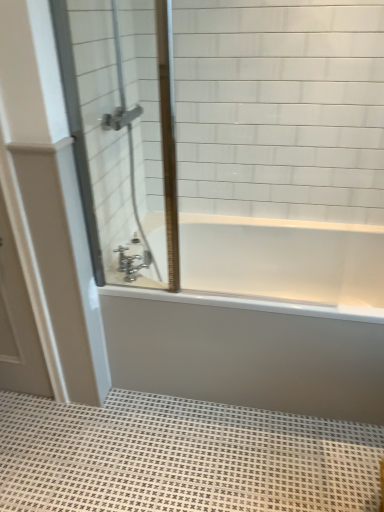
Question: From a real-world perspective, does white matte door at left stand above white textured bath mat at lower center?

Choices:
 (A) yes
 (B) no

Answer: (A)

Question: Is white matte door at left with white textured bath mat at lower center?

Choices:
 (A) no
 (B) yes

Answer: (A)

Question: Considering the relative sizes of white matte door at left and white textured bath mat at lower center in the image provided, is white matte door at left shorter than white textured bath mat at lower center?

Choices:
 (A) yes
 (B) no

Answer: (B)

Question: Does white matte door at left have a larger size compared to white textured bath mat at lower center?

Choices:
 (A) yes
 (B) no

Answer: (B)

Question: Can you confirm if white matte door at left is thinner than white textured bath mat at lower center?

Choices:
 (A) no
 (B) yes

Answer: (B)

Question: Is white matte door at left to the left of white textured bath mat at lower center from the viewer's perspective?

Choices:
 (A) no
 (B) yes

Answer: (B)

Question: Is white matte door at left turned away from chrome metallic faucet at center?

Choices:
 (A) yes
 (B) no

Answer: (B)

Question: Is white matte door at left thinner than chrome metallic faucet at center?

Choices:
 (A) yes
 (B) no

Answer: (A)

Question: From the image's perspective, is white matte door at left located beneath chrome metallic faucet at center?

Choices:
 (A) no
 (B) yes

Answer: (B)

Question: From a real-world perspective, is white matte door at left physically below chrome metallic faucet at center?

Choices:
 (A) yes
 (B) no

Answer: (A)

Question: Is white matte door at left wider than chrome metallic faucet at center?

Choices:
 (A) yes
 (B) no

Answer: (B)

Question: Considering the relative sizes of white matte door at left and chrome metallic faucet at center in the image provided, is white matte door at left smaller than chrome metallic faucet at center?

Choices:
 (A) yes
 (B) no

Answer: (B)

Question: Is white glossy bathtub at center located within chrome metallic faucet at center?

Choices:
 (A) no
 (B) yes

Answer: (A)